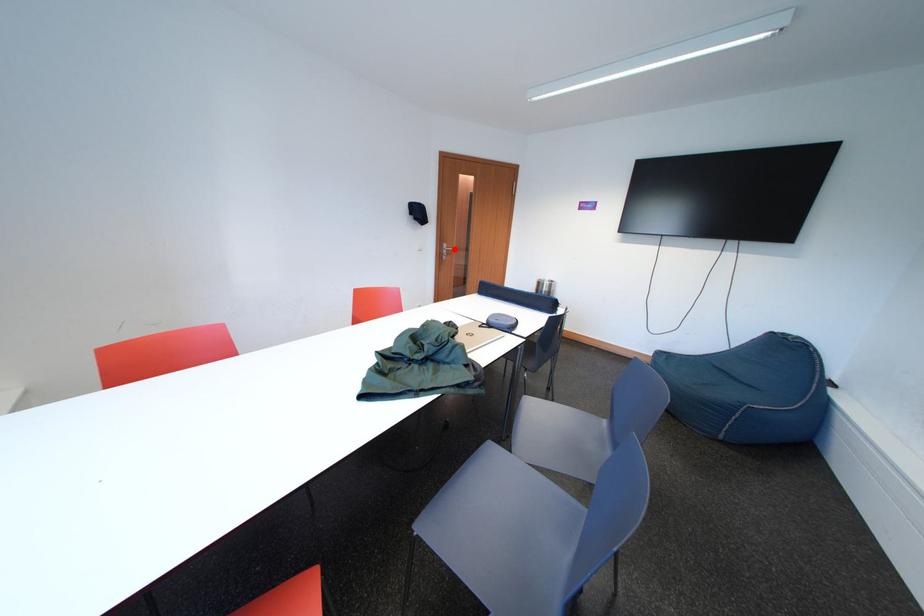
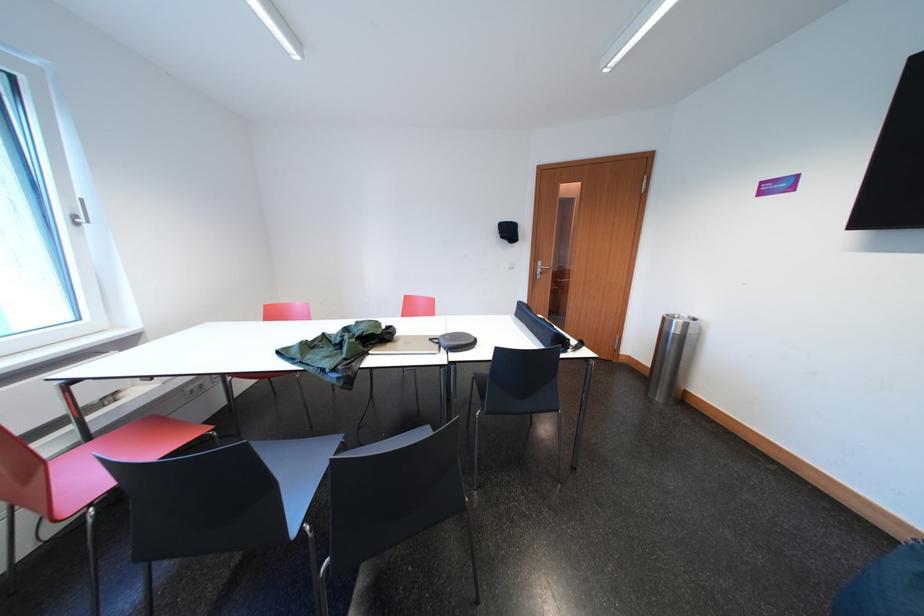
Find the pixel in the second image that matches the highlighted location in the first image.

(550, 268)